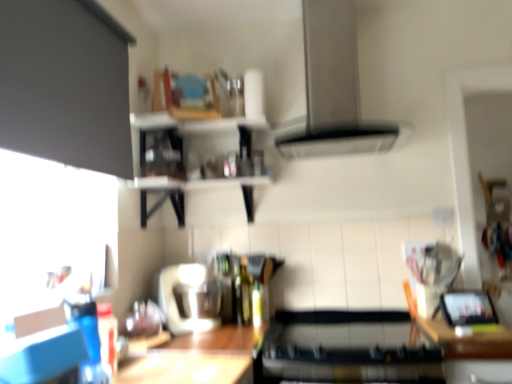
What do you see at coordinates (65, 84) in the screenshot?
I see `matte black cabinet at upper left` at bounding box center [65, 84].

I want to click on green glass bottle at center, so click(242, 294).

In order to click on black matte stove at center, the first appliance when ordered from right to left in this screenshot , I will do `click(346, 350)`.

The height and width of the screenshot is (384, 512). What do you see at coordinates (346, 350) in the screenshot?
I see `black matte stove at center, the first appliance when ordered from right to left` at bounding box center [346, 350].

What do you see at coordinates (467, 341) in the screenshot?
I see `wooden at right` at bounding box center [467, 341].

Describe the element at coordinates (175, 300) in the screenshot. I see `white glossy blender at center, which appears as the second appliance when viewed from the right` at that location.

Locate an element on the screen. matte black cabinet at upper left is located at coordinates [x=65, y=84].

From a real-world perspective, which is physically above, wooden shelves at upper center or wooden at right?

From a 3D spatial view, wooden shelves at upper center is above.

Looking at this image, is wooden shelves at upper center looking in the opposite direction of wooden at right?

No, wooden shelves at upper center's orientation is not away from wooden at right.

Between wooden shelves at upper center and wooden at right, which one has larger width?

wooden at right.

In the image, is wooden shelves at upper center positioned in front of or behind wooden at right?

Visually, wooden shelves at upper center is located behind wooden at right.

From the picture: How different are the orientations of matte black cabinet at upper left and white glossy blender at center, which is counted as the first appliance, starting from the left, in degrees?

They differ by 0.535 degrees in their facing directions.

Based on the photo, considering the positions of objects matte black cabinet at upper left and white glossy blender at center, which appears as the second appliance when viewed from the right, in the image provided, who is more to the right, matte black cabinet at upper left or white glossy blender at center, which appears as the second appliance when viewed from the right,?

white glossy blender at center, which appears as the second appliance when viewed from the right, is more to the right.

From the image's perspective, is matte black cabinet at upper left located above or below white glossy blender at center, which is counted as the first appliance, starting from the left?

matte black cabinet at upper left is situated higher than white glossy blender at center, which is counted as the first appliance, starting from the left, in the image.

Can you confirm if matte black cabinet at upper left is wider than white glossy blender at center, which appears as the second appliance when viewed from the right?

No, matte black cabinet at upper left is not wider than white glossy blender at center, which appears as the second appliance when viewed from the right.

Is wooden at right far away from satin silver exhaust hood at upper center?

No.

Identify the location of counter top on the right of satin silver exhaust hood at upper center. (467, 341).

In the image, is wooden at right positioned in front of or behind satin silver exhaust hood at upper center?

Visually, wooden at right is located in front of satin silver exhaust hood at upper center.

In the scene shown: Is wooden shelves at upper center facing away from matte black cabinet at upper left?

wooden shelves at upper center is not turned away from matte black cabinet at upper left.

Considering the points (206, 187) and (39, 68), which point is in front, point (206, 187) or point (39, 68)?

The point (39, 68) is closer to the camera.

Is wooden shelves at upper center bigger or smaller than matte black cabinet at upper left?

Considering their sizes, wooden shelves at upper center takes up more space than matte black cabinet at upper left.

What's the angular difference between black matte stove at center, the first appliance when ordered from right to left, and matte black cabinet at upper left's facing directions?

90.5 degrees separate the facing orientations of black matte stove at center, the first appliance when ordered from right to left, and matte black cabinet at upper left.

Does point (282, 313) lie behind point (87, 16)?

That is True.

Considering the sizes of black matte stove at center, the 2th appliance viewed from the left, and matte black cabinet at upper left in the image, is black matte stove at center, the 2th appliance viewed from the left, bigger or smaller than matte black cabinet at upper left?

In the image, black matte stove at center, the 2th appliance viewed from the left, appears to be smaller than matte black cabinet at upper left.

From a real-world perspective, who is located higher, black matte stove at center, the 2th appliance viewed from the left, or matte black cabinet at upper left?

matte black cabinet at upper left.

Between matte black cabinet at upper left and wooden shelves at upper center, which one is positioned in front?

matte black cabinet at upper left is closer to the camera.

Is matte black cabinet at upper left not near wooden shelves at upper center?

matte black cabinet at upper left is actually quite close to wooden shelves at upper center.

The image size is (512, 384). I want to click on shelf lying below the matte black cabinet at upper left (from the image's perspective), so click(x=195, y=182).

Is point (44, 32) positioned after point (261, 177)?

No.

Can you see white glossy blender at center, which is counted as the first appliance, starting from the left, touching wooden at right?

No.

Considering the sizes of objects white glossy blender at center, which is counted as the first appliance, starting from the left, and wooden at right in the image provided, who is taller, white glossy blender at center, which is counted as the first appliance, starting from the left, or wooden at right?

With more height is wooden at right.

Could you tell me if white glossy blender at center, which appears as the second appliance when viewed from the right, is turned towards wooden at right?

Yes, white glossy blender at center, which appears as the second appliance when viewed from the right, faces towards wooden at right.

Can you confirm if white glossy blender at center, which appears as the second appliance when viewed from the right, is smaller than wooden at right?

Yes, white glossy blender at center, which appears as the second appliance when viewed from the right, is smaller than wooden at right.

Find the location of a particular element. The image size is (512, 384). counter top below the wooden shelves at upper center (from the image's perspective) is located at coordinates (467, 341).

Where is `cabinetry above the white glossy blender at center, which is counted as the first appliance, starting from the left (from the image's perspective)`? cabinetry above the white glossy blender at center, which is counted as the first appliance, starting from the left (from the image's perspective) is located at coordinates (65, 84).

When comparing their distances from matte black cabinet at upper left, does wooden shelves at upper center or green glass bottle at center seem further?

green glass bottle at center lies further to matte black cabinet at upper left than the other object.

Considering their positions, is wooden at right positioned further to matte black cabinet at upper left than black matte stove at center, the 2th appliance viewed from the left?

wooden at right is positioned further to the anchor matte black cabinet at upper left.

Considering their positions, is wooden shelves at upper center positioned further to satin silver exhaust hood at upper center than black matte stove at center, the 2th appliance viewed from the left?

black matte stove at center, the 2th appliance viewed from the left, lies further to satin silver exhaust hood at upper center than the other object.

Estimate the real-world distances between objects in this image. Which object is closer to green glass bottle at center, wooden table at lower center or white glossy blender at center, which is counted as the first appliance, starting from the left?

white glossy blender at center, which is counted as the first appliance, starting from the left, lies closer to green glass bottle at center than the other object.

Estimate the real-world distances between objects in this image. Which object is further from wooden at right, black matte stove at center, the 2th appliance viewed from the left, or wooden table at lower center?

wooden table at lower center is positioned further to the anchor wooden at right.

Considering their positions, is wooden at right positioned closer to wooden shelves at upper center than white glossy blender at center, which is counted as the first appliance, starting from the left?

Based on the image, white glossy blender at center, which is counted as the first appliance, starting from the left, appears to be nearer to wooden shelves at upper center.

From the image, which object appears to be nearer to green glass bottle at center, white glossy blender at center, which appears as the second appliance when viewed from the right, or wooden at right?

→ white glossy blender at center, which appears as the second appliance when viewed from the right, is positioned closer to the anchor green glass bottle at center.

Considering their positions, is green glass bottle at center positioned further to black matte stove at center, the first appliance when ordered from right to left, than satin silver exhaust hood at upper center?

Among the two, satin silver exhaust hood at upper center is located further to black matte stove at center, the first appliance when ordered from right to left.

Find the location of a particular element. The width and height of the screenshot is (512, 384). bottle situated between wooden table at lower center and wooden at right from left to right is located at coordinates (242, 294).

Image resolution: width=512 pixels, height=384 pixels. I want to click on bottle between matte black cabinet at upper left and white glossy blender at center, which is counted as the first appliance, starting from the left, in the vertical direction, so click(x=242, y=294).

The height and width of the screenshot is (384, 512). What are the coordinates of `bottle between white glossy blender at center, which is counted as the first appliance, starting from the left, and black matte stove at center, the first appliance when ordered from right to left, in the horizontal direction` in the screenshot? It's located at (242, 294).

Where is `shelf between satin silver exhaust hood at upper center and wooden at right in the vertical direction`? shelf between satin silver exhaust hood at upper center and wooden at right in the vertical direction is located at coordinates (195, 182).